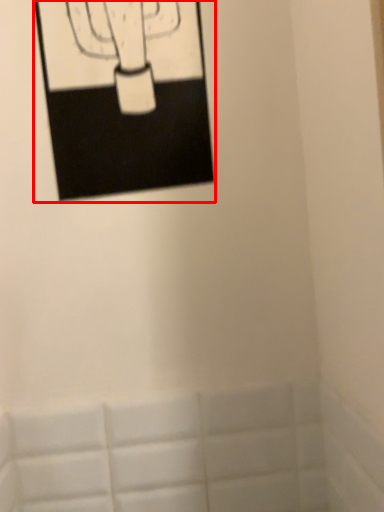
Question: Where is picture frame (annotated by the red box) located in relation to bath in the image?

Choices:
 (A) right
 (B) left

Answer: (B)